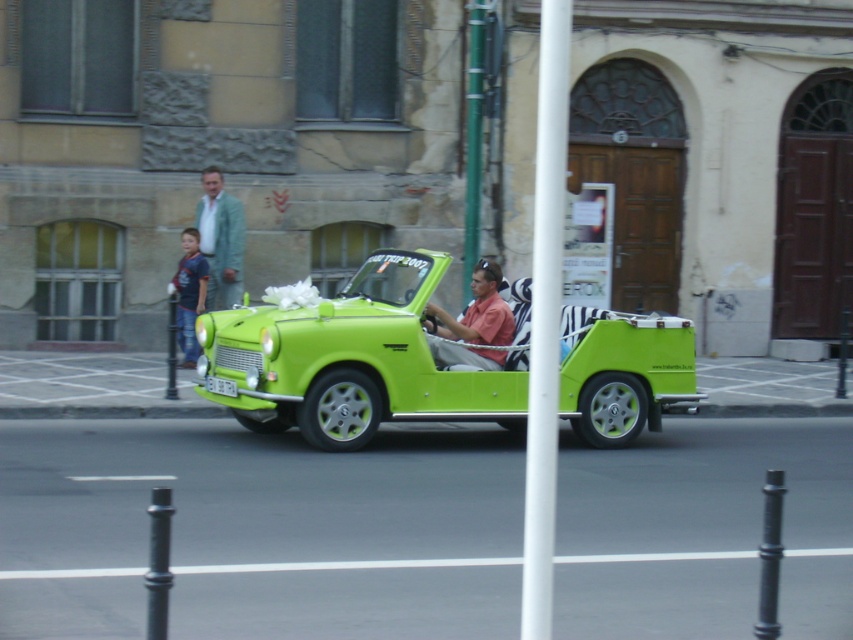
You are a photographer standing on the sidewalk. You want to take a photo of the lime green plastic car at center and the pink matte shirt at center. Which object is taller in the image?

The lime green plastic car at center is taller than the pink matte shirt at center.

You are a pedestrian standing on the sidewalk and see the lime green plastic car at center and the green metallic pole at center in the middle of the road. Which object takes up more space in the road?

The lime green plastic car at center is bigger than the green metallic pole at center, so it takes up more space in the road.